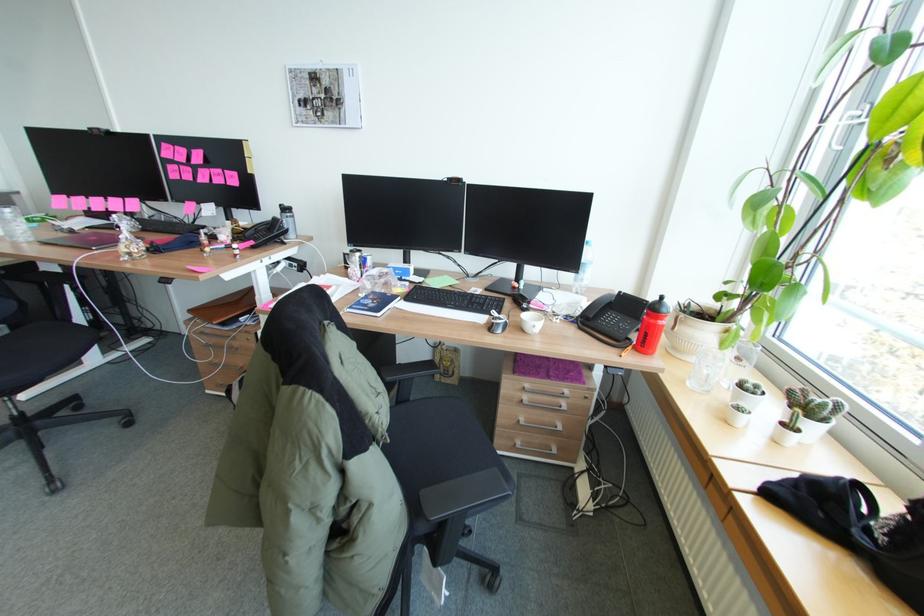
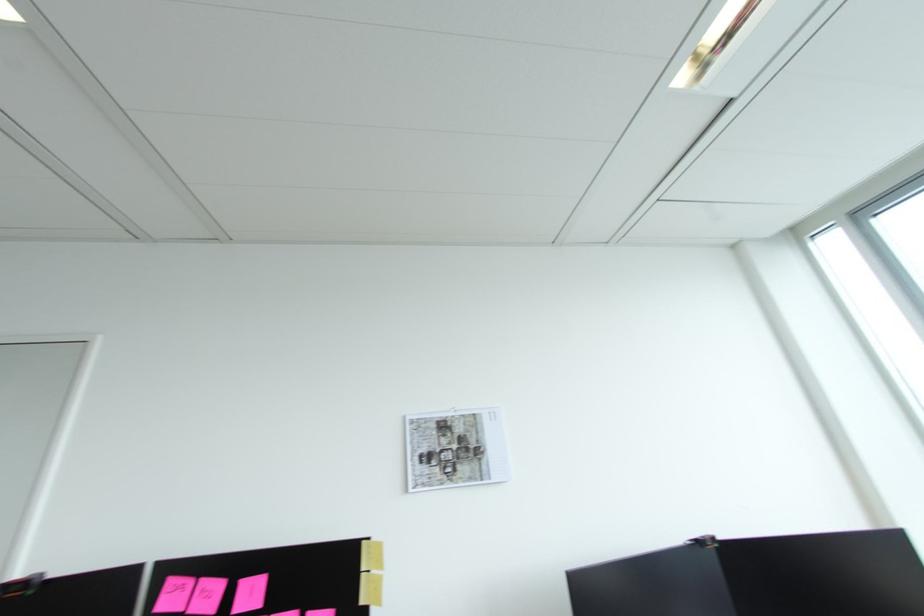
Where in the second image is the point corresponding to the point at 254,172 from the first image?

(366, 602)